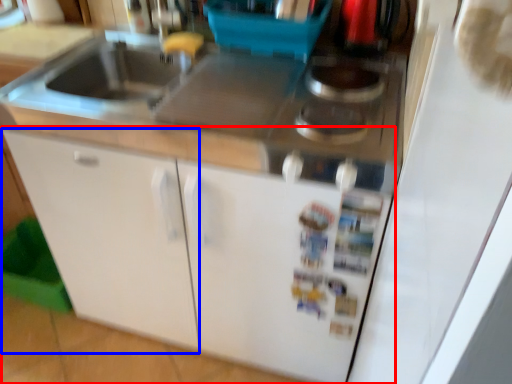
Question: Among these objects, which one is farthest to the camera, cabinetry (highlighted by a red box) or cabinetry (highlighted by a blue box)?

Choices:
 (A) cabinetry
 (B) cabinetry

Answer: (A)